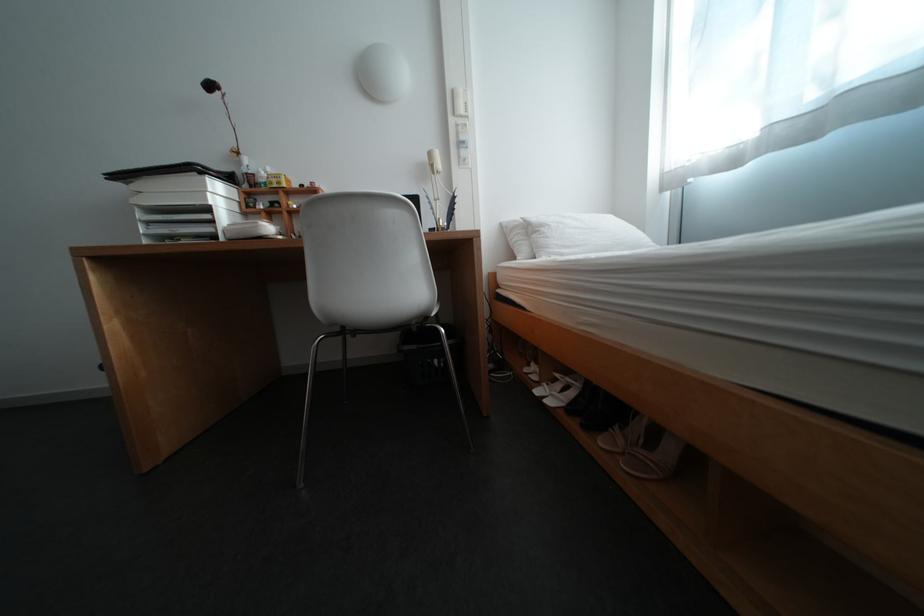
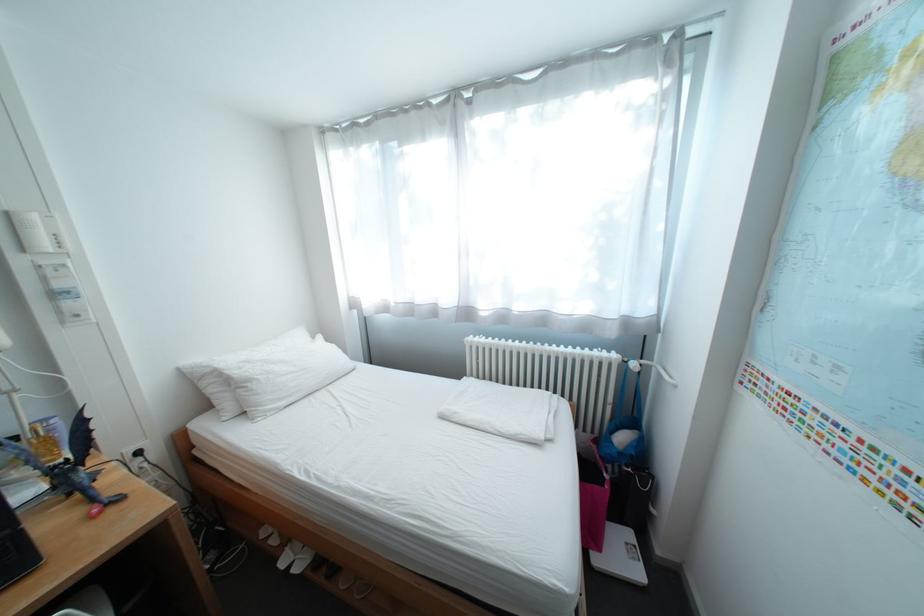
Where in the second image is the point corresponding to the point at 555,228 from the first image?

(263, 383)